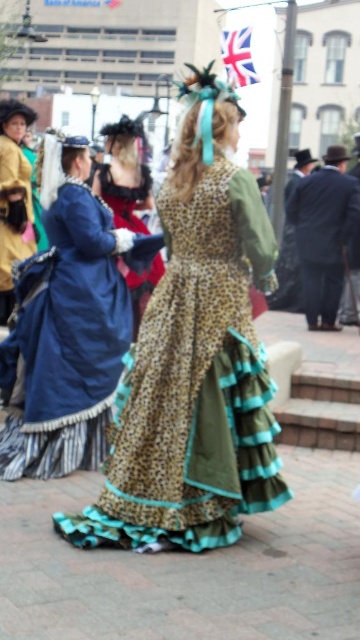
You are standing in the public square and want to take a photo of the two points mentioned. Which point is closer to you, point (x=180, y=371) or point (x=312, y=246)?

Point (x=180, y=371) is closer to you than point (x=312, y=246).

You are a costume designer observing the leopard print fabric dress at center and the dark blue suit at center in the image. Which costume requires less fabric to make?

The leopard print fabric dress at center has a smaller size compared to the dark blue suit at center, so it requires less fabric to make.